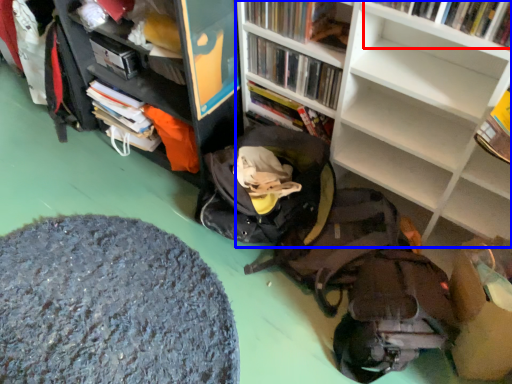
Question: Which point is closer to the camera, book (highlighted by a red box) or bookcase (highlighted by a blue box)?

Choices:
 (A) book
 (B) bookcase

Answer: (B)